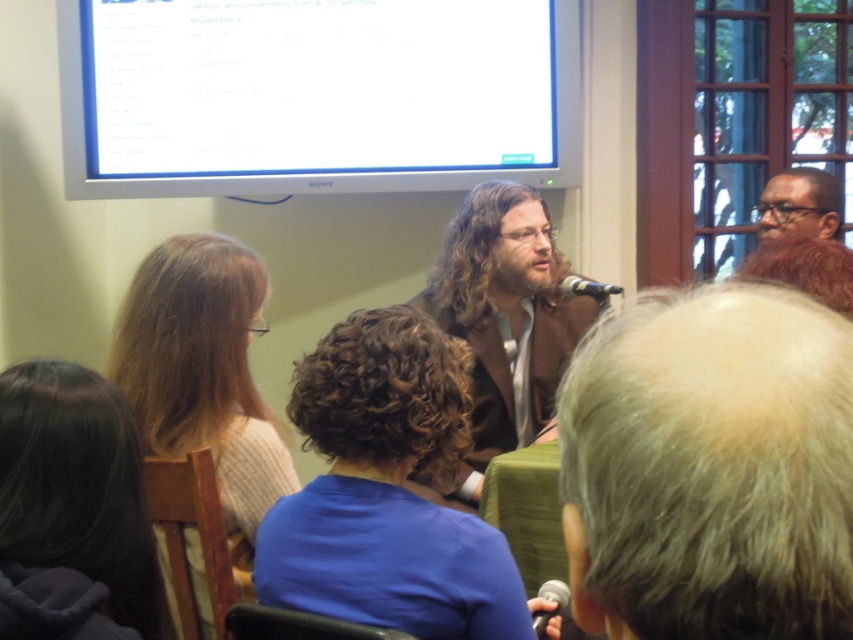
Consider the image. Between dark brown hair at lower left and black metallic microphone at center, which one is positioned lower?

dark brown hair at lower left

Find the location of a particular element. This screenshot has width=853, height=640. dark brown hair at lower left is located at coordinates point(73,509).

Where is `dark brown hair at lower left`? This screenshot has height=640, width=853. dark brown hair at lower left is located at coordinates (73, 509).

Between white glossy projector screen at upper center and blue fabric shirt at center, which one has more height?

white glossy projector screen at upper center

Can you confirm if white glossy projector screen at upper center is shorter than blue fabric shirt at center?

In fact, white glossy projector screen at upper center may be taller than blue fabric shirt at center.

Is point (350, 4) farther from camera compared to point (297, 531)?

Yes, it is.

This screenshot has width=853, height=640. I want to click on white glossy projector screen at upper center, so click(x=316, y=96).

In the scene shown: Who is lower down, blue fabric shirt at center or dark brown hair at lower left?

dark brown hair at lower left is below.

Measure the distance from blue fabric shirt at center to dark brown hair at lower left.

blue fabric shirt at center and dark brown hair at lower left are 12.52 inches apart from each other.

Is point (369, 522) behind point (157, 595)?

No.

Identify the location of blue fabric shirt at center. This screenshot has width=853, height=640. (386, 490).